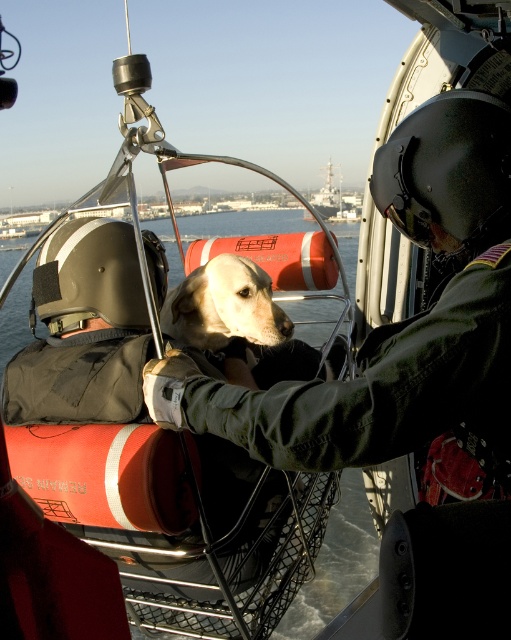
Does golden fur dog at center come in front of metallic gray ship at center?

Yes.

Locate an element on the screen. This screenshot has height=640, width=511. golden fur dog at center is located at coordinates (224, 307).